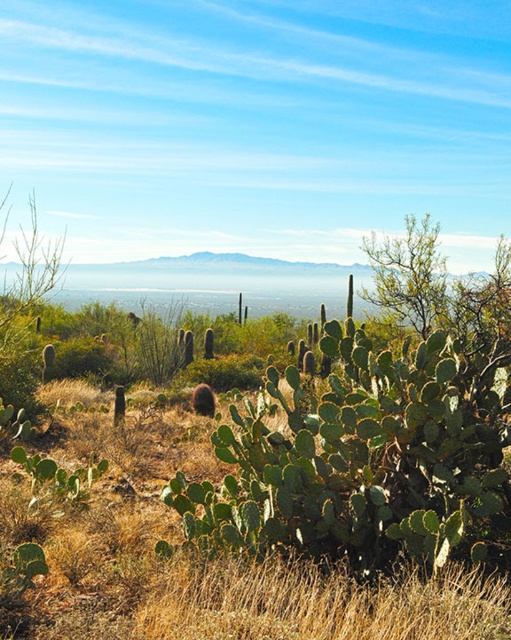
Question: Where is green spiny cactus at center located in relation to green leafy grass at center in the image?

Choices:
 (A) below
 (B) above

Answer: (B)

Question: Which of the following is the farthest from the observer?

Choices:
 (A) (449, 410)
 (B) (240, 625)

Answer: (A)

Question: Among these objects, which one is nearest to the camera?

Choices:
 (A) green leafy grass at center
 (B) green spiny cactus at center

Answer: (A)

Question: Is green spiny cactus at center smaller than green leafy grass at center?

Choices:
 (A) yes
 (B) no

Answer: (A)

Question: Can you confirm if green spiny cactus at center is thinner than green leafy grass at center?

Choices:
 (A) no
 (B) yes

Answer: (B)